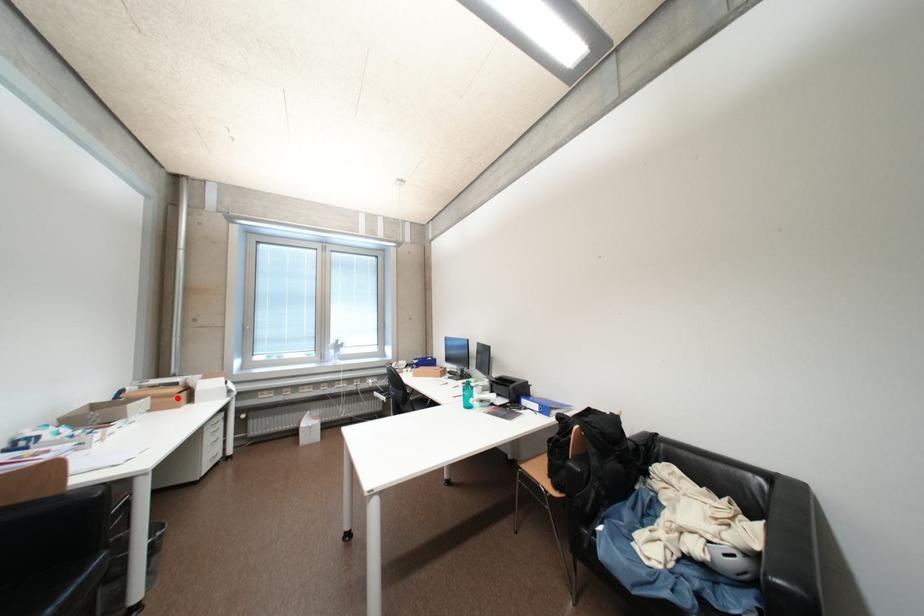
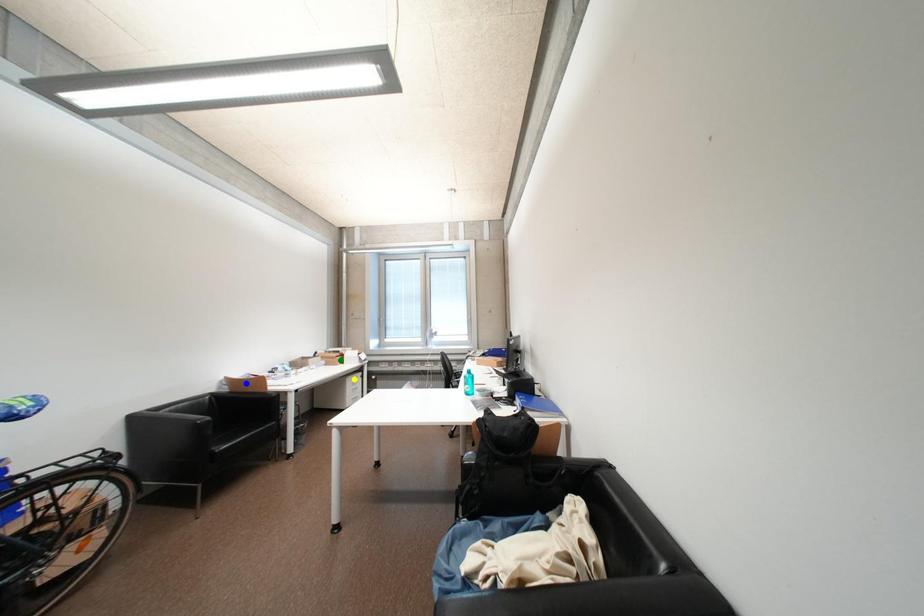
Question: I am providing you with two images of the same scene from different viewpoints. A red point is marked on the first image. You are given multiple points on the second image. Which point in image 2 is actually the same real-world point as the red point in image 1?

Choices:
 (A) blue point
 (B) green point
 (C) yellow point

Answer: (B)